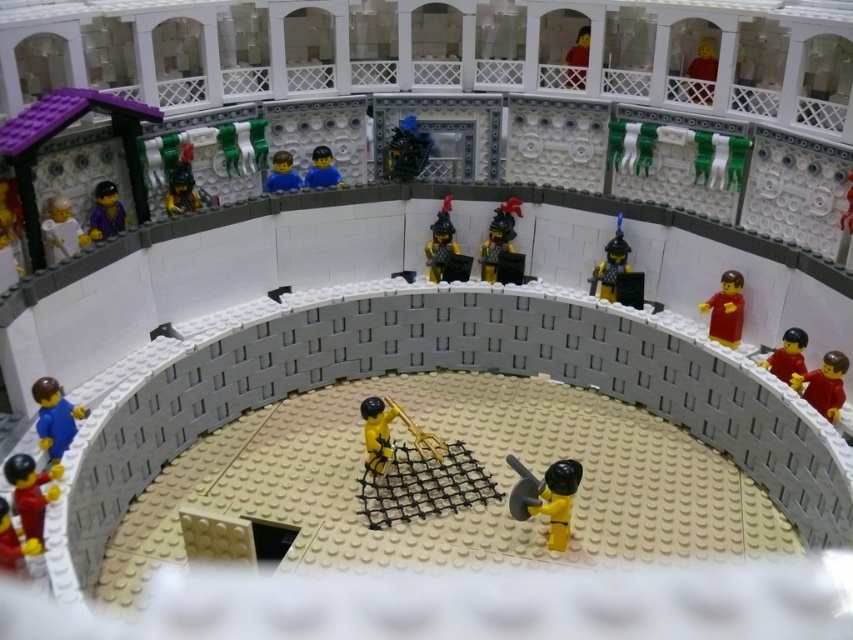
In the LEGO amphitheater scene, there are two figures in the arena. One is the red plastic figure at right and the other is the blue matte figure at center. From the perspective of someone standing at the back of the amphitheater looking towards the arena, which figure is positioned to the right of the other?

The red plastic figure at right is positioned to the right of the blue matte figure at center.

You are a LEGO figure collector examining this diorama. You notice the red plastic figure at right and the blue matte figure at center. Which of these two figures is taller?

The red plastic figure at right is taller than the blue matte figure at center.

In the LEGO Roman amphitheater scene, there is a yellow matte figure at center and a smooth red minifigure at right. From the perspective of someone standing at the back of the amphitheater, which figure is closer to the front edge of the arena?

The yellow matte figure at center is closer to the front edge of the arena because it is positioned in front of the smooth red minifigure at right.